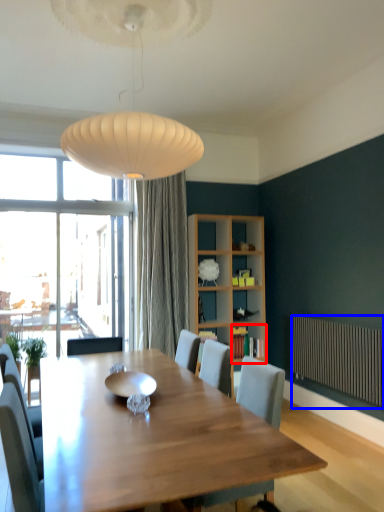
Question: Which point is further to the camera, shelf (highlighted by a red box) or radiator (highlighted by a blue box)?

Choices:
 (A) shelf
 (B) radiator

Answer: (A)